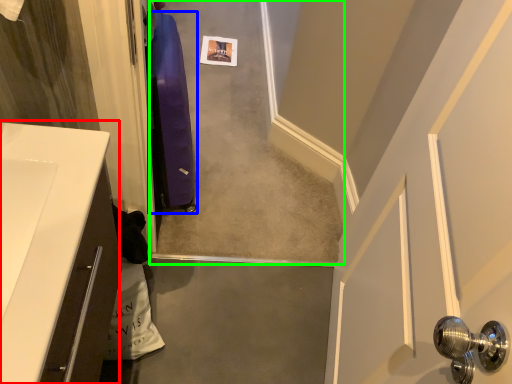
Question: Estimate the real-world distances between objects in this image. Which object is closer to counter top (highlighted by a red box), luggage (highlighted by a blue box) or concrete (highlighted by a green box)?

Choices:
 (A) luggage
 (B) concrete

Answer: (A)